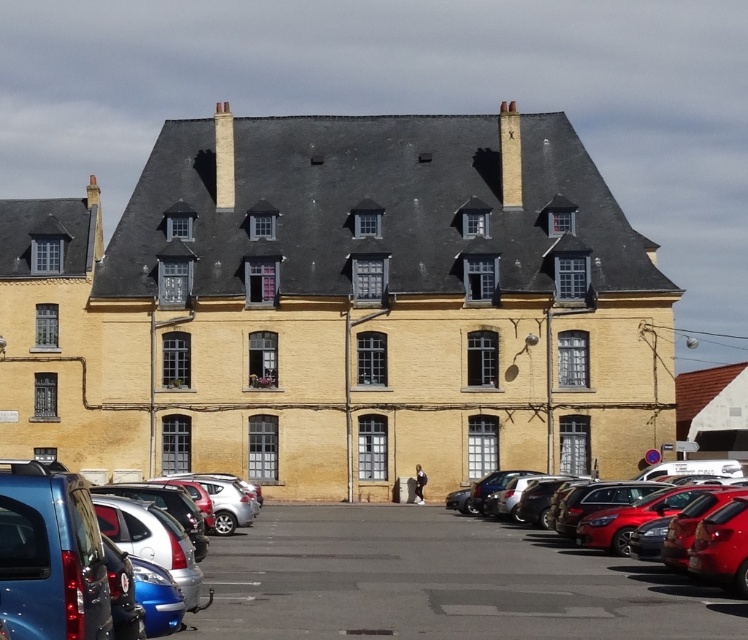
Question: Is metallic silver car at lower left further to camera compared to shiny red car at lower right?

Choices:
 (A) yes
 (B) no

Answer: (B)

Question: Does metallic silver car at lower left have a larger size compared to shiny blue sedan at lower left?

Choices:
 (A) yes
 (B) no

Answer: (B)

Question: Does shiny blue sedan at lower left lie behind shiny red car at lower right?

Choices:
 (A) yes
 (B) no

Answer: (B)

Question: Which of these objects is positioned farthest from the shiny blue sedan at lower left?

Choices:
 (A) metallic silver car at lower left
 (B) shiny red car at lower right

Answer: (B)

Question: Which of the following is the farthest from the observer?

Choices:
 (A) (233, 589)
 (B) (607, 532)

Answer: (B)

Question: Which point is closer to the camera taking this photo?

Choices:
 (A) (46, 586)
 (B) (571, 524)

Answer: (A)